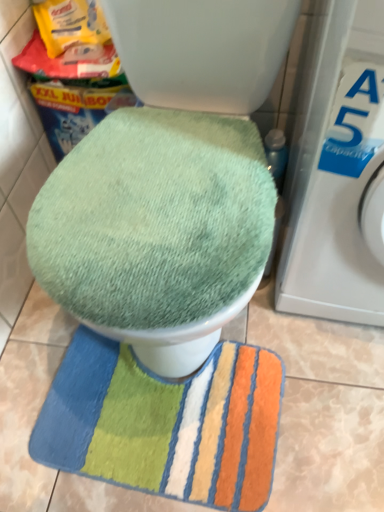
In order to face green plush rug at lower center, should I rotate leftwards or rightwards?

It's best to rotate left around 3.720 degrees.

Image resolution: width=384 pixels, height=512 pixels. What do you see at coordinates (338, 192) in the screenshot? I see `white plastic washing machine at right` at bounding box center [338, 192].

You are a GUI agent. You are given a task and a screenshot of the screen. Output one action in this format:
    pyautogui.click(x=<x>, y=<y>)
    Task: Click on the white plastic washing machine at right
    This screenshot has height=512, width=384.
    Given the screenshot: What is the action you would take?
    pyautogui.click(x=338, y=192)

Where is `green plush rug at lower center`? green plush rug at lower center is located at coordinates (165, 423).

Is green fabric toilet seat at center at the back of green plush rug at lower center?

No.

Measure the distance from green plush rug at lower center to green fabric toilet seat at center.

green plush rug at lower center and green fabric toilet seat at center are 16.63 inches apart.

Between green plush rug at lower center and green fabric toilet seat at center, which one has less height?

With less height is green plush rug at lower center.

Is green fabric toilet seat at center a part of green plush rug at lower center?

Definitely not — green fabric toilet seat at center is not inside green plush rug at lower center.

What's the angular difference between white plastic washing machine at right and green plush rug at lower center's facing directions?

They differ by 1.91 degrees in their facing directions.

Between white plastic washing machine at right and green plush rug at lower center, which one is positioned behind?

Positioned behind is green plush rug at lower center.

From the image's perspective, is white plastic washing machine at right on top of green plush rug at lower center?

Correct, white plastic washing machine at right appears higher than green plush rug at lower center in the image.

Is white plastic washing machine at right facing towards green plush rug at lower center?

No, white plastic washing machine at right is not oriented towards green plush rug at lower center.

I want to click on beach towel below the white plastic washing machine at right (from a real-world perspective), so click(165, 423).

Is green plush rug at lower center oriented towards white plastic washing machine at right?

No, green plush rug at lower center is not aimed at white plastic washing machine at right.

Are green plush rug at lower center and white plastic washing machine at right beside each other?

No, green plush rug at lower center is not in contact with white plastic washing machine at right.

Does green plush rug at lower center have a smaller size compared to white plastic washing machine at right?

Correct, green plush rug at lower center occupies less space than white plastic washing machine at right.

Consider the image. What's the angular difference between white plastic washing machine at right and green fabric toilet seat at center's facing directions?

white plastic washing machine at right and green fabric toilet seat at center are facing 1.89 degrees away from each other.

Is white plastic washing machine at right surrounding green fabric toilet seat at center?

No, green fabric toilet seat at center is located outside of white plastic washing machine at right.

Based on the photo, who is smaller, white plastic washing machine at right or green fabric toilet seat at center?

white plastic washing machine at right.

Do you think green fabric toilet seat at center is within white plastic washing machine at right, or outside of it?

green fabric toilet seat at center cannot be found inside white plastic washing machine at right.

Is green fabric toilet seat at center next to white plastic washing machine at right and touching it?

No, green fabric toilet seat at center is not in contact with white plastic washing machine at right.

Which is more to the right, green fabric toilet seat at center or white plastic washing machine at right?

white plastic washing machine at right is more to the right.

Which of these two, green fabric toilet seat at center or green plush rug at lower center, is thinner?

green plush rug at lower center.

From the image's perspective, is green fabric toilet seat at center beneath green plush rug at lower center?

Incorrect, from the image's perspective, green fabric toilet seat at center is higher than green plush rug at lower center.

From a real-world perspective, which object rests below the other?

In real-world perspective, green plush rug at lower center is lower.

Measure the distance from green fabric toilet seat at center to green plush rug at lower center.

green fabric toilet seat at center and green plush rug at lower center are 42.23 centimeters apart.

Where is `toilet on the right of green plush rug at lower center`? The image size is (384, 512). toilet on the right of green plush rug at lower center is located at coordinates (203, 50).

Where is `washing machine above the green plush rug at lower center (from a real-world perspective)`? Image resolution: width=384 pixels, height=512 pixels. washing machine above the green plush rug at lower center (from a real-world perspective) is located at coordinates pyautogui.click(x=338, y=192).

Looking at the image, which one is located closer to green plush rug at lower center, green fabric toilet seat at center or white plastic washing machine at right?

white plastic washing machine at right is positioned closer to the anchor green plush rug at lower center.

Which object lies nearer to the anchor point green fabric toilet seat at center, green plush rug at lower center or white plastic washing machine at right?

white plastic washing machine at right lies closer to green fabric toilet seat at center than the other object.

Which object lies nearer to the anchor point white plastic washing machine at right, green plush rug at lower center or green fabric toilet seat at center?

green fabric toilet seat at center is closer to white plastic washing machine at right.

From the image, which object appears to be nearer to green fabric toilet seat at center, white plastic washing machine at right or green plush rug at lower center?

white plastic washing machine at right lies closer to green fabric toilet seat at center than the other object.

Which object lies nearer to the anchor point green plush rug at lower center, white plastic washing machine at right or green fabric toilet seat at center?

The object closer to green plush rug at lower center is white plastic washing machine at right.

Considering their positions, is green fabric toilet seat at center positioned further to white plastic washing machine at right than green plush rug at lower center?

The object further to white plastic washing machine at right is green plush rug at lower center.

Locate an element on the screen. toilet between white plastic washing machine at right and green plush rug at lower center in the up-down direction is located at coordinates (203, 50).